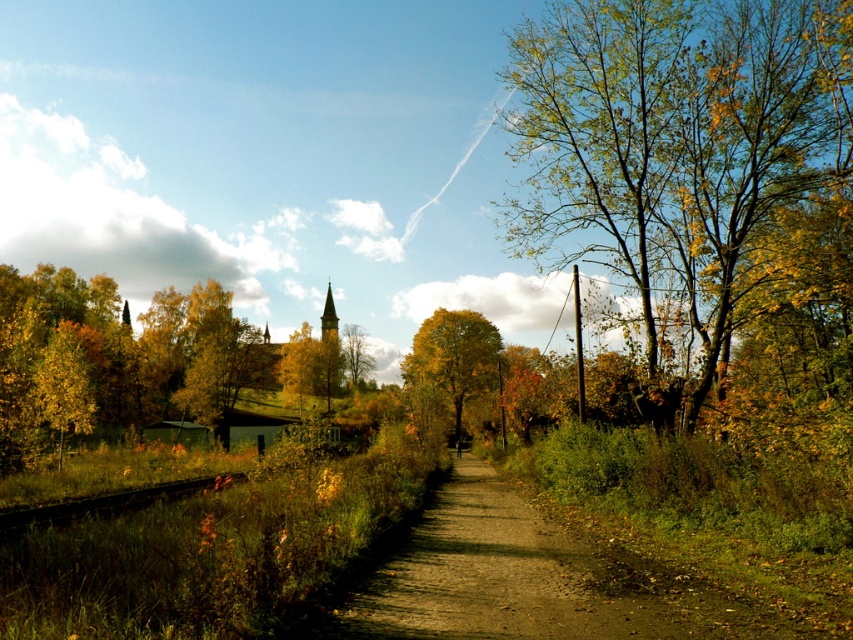
You are a hiker standing on the dirt path in the foreground. You see golden yellow leaves at center and smooth gray steeple at center. Which object is closer to your left side?

The golden yellow leaves at center is to the left of smooth gray steeple at center, so the golden yellow leaves at center is closer to your left side.

Looking at this image, you are a hiker standing on the dirt path and looking at the golden yellow leaves at center and the smooth gray steeple at center. Which object is closer to you?

The golden yellow leaves at center are closer to you since they are in front of the smooth gray steeple at center.